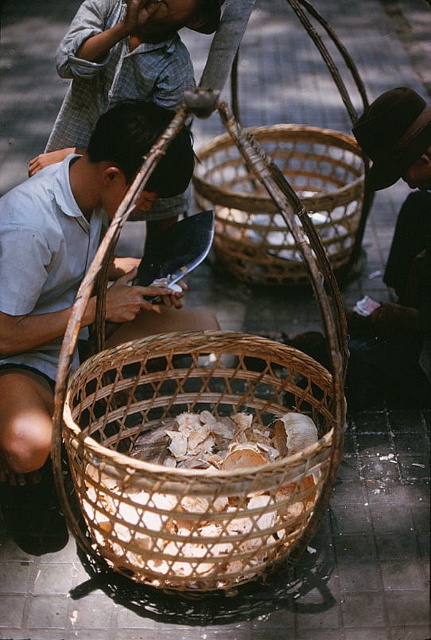
Which is in front, point (339, 204) or point (389, 108)?

Point (389, 108)

Which of these two, woven bamboo basket at center or dark brown hat at upper right, stands shorter?

dark brown hat at upper right is shorter.

What do you see at coordinates (244, 218) in the screenshot?
I see `woven bamboo basket at center` at bounding box center [244, 218].

At what (x,y) coordinates should I click in order to perform the action: click on woven bamboo basket at center. Please return your answer as a coordinate pair (x, y). The image size is (431, 640). Looking at the image, I should click on (244, 218).

Which is behind, point (9, 292) or point (106, 508)?

Positioned behind is point (9, 292).

Which is below, matte wicker basket at center or white textured shells at center?

Positioned lower is white textured shells at center.

Between point (37, 380) and point (284, 499), which one is positioned in front?

Point (284, 499)

Identify the location of matte wicker basket at center. (56, 266).

Can you confirm if matte wicker basket at center is thinner than woven bamboo basket at center?

Yes.

Does point (94, 192) lie behind point (231, 262)?

No, (94, 192) is closer to viewer.

The image size is (431, 640). What are the coordinates of `matte wicker basket at center` in the screenshot? It's located at (56, 266).